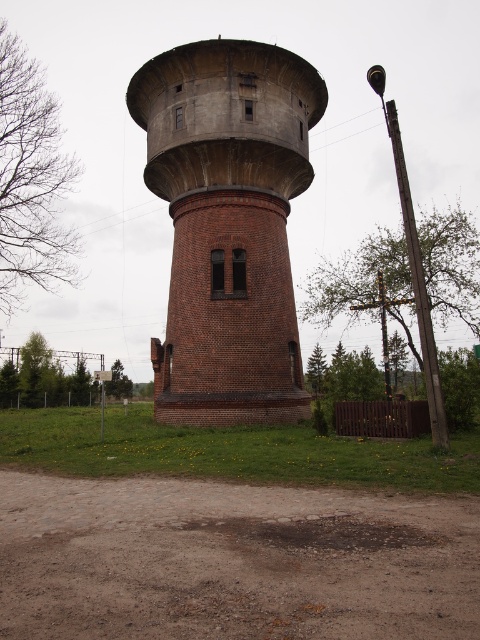
You are standing near the brick textured tower at center and want to place a small garden at the brown gravel dirt at center. Which direction should you walk to reach the area where you can plant the garden?

The brown gravel dirt at center is below the brick textured tower at center, so you should walk downward or towards the base of the brick textured tower at center to reach the brown gravel dirt at center and plant the garden.

You are standing at the point labeled point [60,477] and want to walk directly towards the viewer. How far will you have to walk to reach the viewer?

The distance between point [60,477] and the viewer is 12.80 meters, so you will have to walk 12.80 meters to reach the viewer.

You are standing at the base of the cylindrical brick water tower and looking towards the wooden fence on the right. Where would you find the brown gravel dirt at center relative to your position?

The brown gravel dirt at center is located at the point with coordinates 0.877 on the x axis and 0.483 on the y axis relative to your position at the base of the tower.